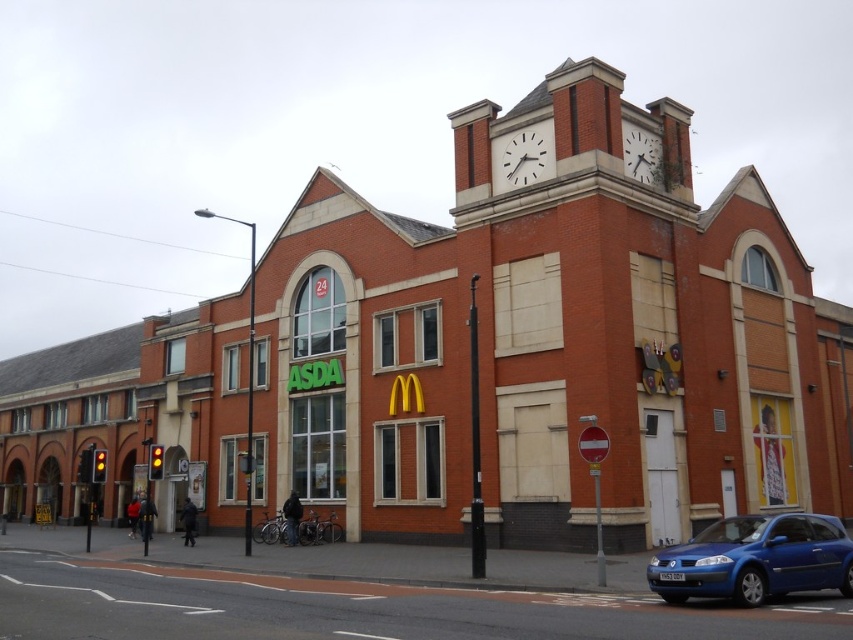
Question: Estimate the real-world distances between objects in this image. Which object is farther from the white metallic clock at upper center?

Choices:
 (A) white clock face at upper center
 (B) blue metallic car at lower right

Answer: (B)

Question: Does blue metallic car at lower right appear under white metallic clock at upper center?

Choices:
 (A) no
 (B) yes

Answer: (B)

Question: Which point is closer to the camera?

Choices:
 (A) white clock face at upper center
 (B) blue metallic car at lower right

Answer: (B)

Question: Is blue metallic car at lower right bigger than white metallic clock at upper center?

Choices:
 (A) yes
 (B) no

Answer: (A)

Question: Does blue metallic car at lower right appear over white metallic clock at upper center?

Choices:
 (A) no
 (B) yes

Answer: (A)

Question: Estimate the real-world distances between objects in this image. Which object is farther from the white clock face at upper center?

Choices:
 (A) blue metallic car at lower right
 (B) white metallic clock at upper center

Answer: (A)